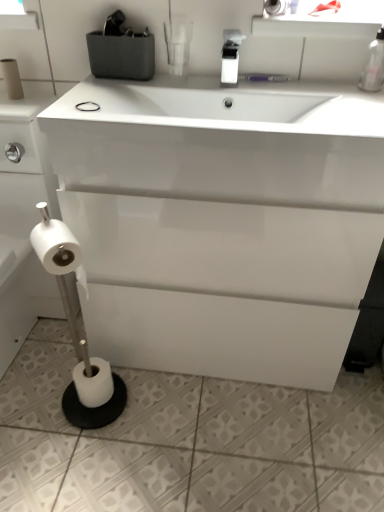
Where is `free spot behind black rubber band at upper center`? free spot behind black rubber band at upper center is located at coordinates pyautogui.click(x=118, y=92).